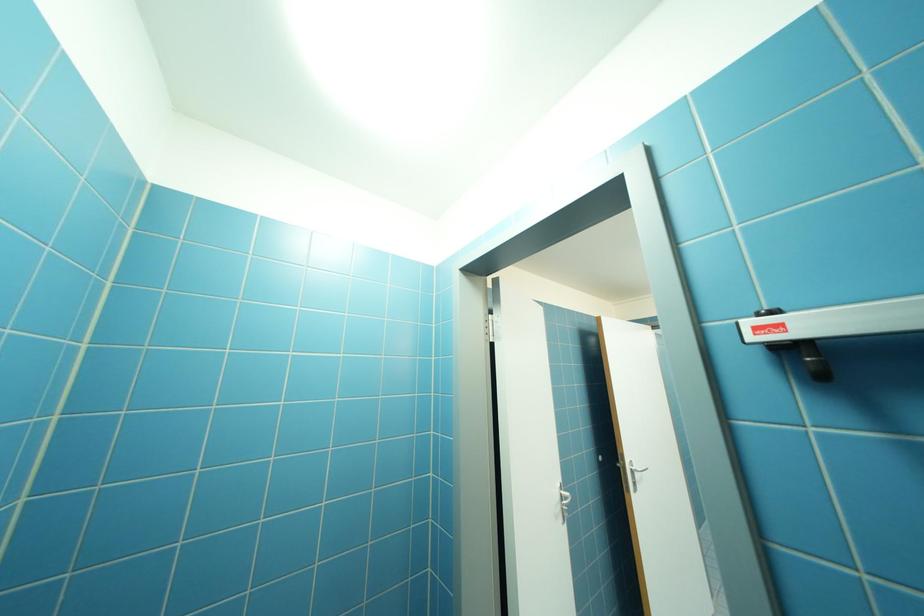
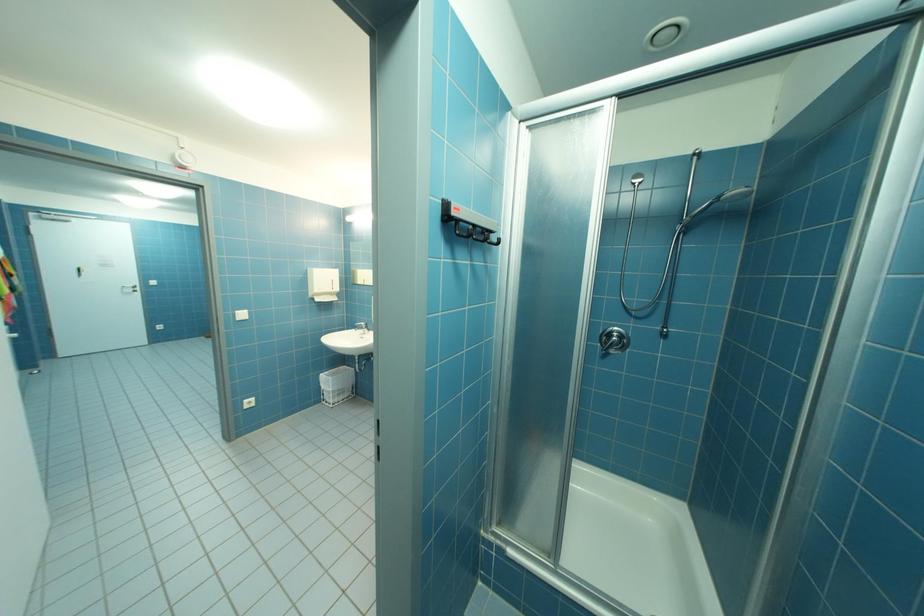
Question: The first image is from the beginning of the video and the second image is from the end. How did the camera likely rotate when shooting the video?

Choices:
 (A) Left
 (B) Right
 (C) Up
 (D) Down

Answer: (B)